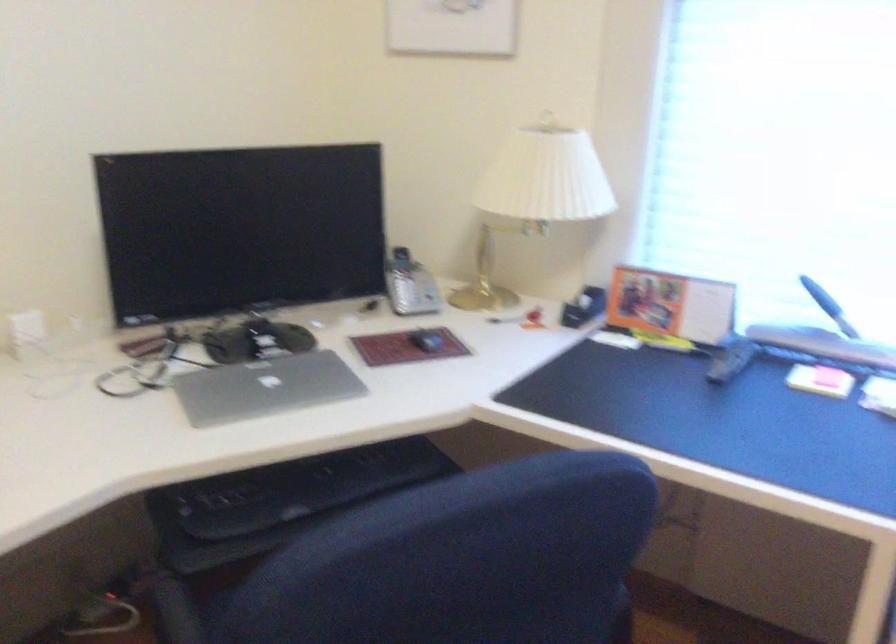
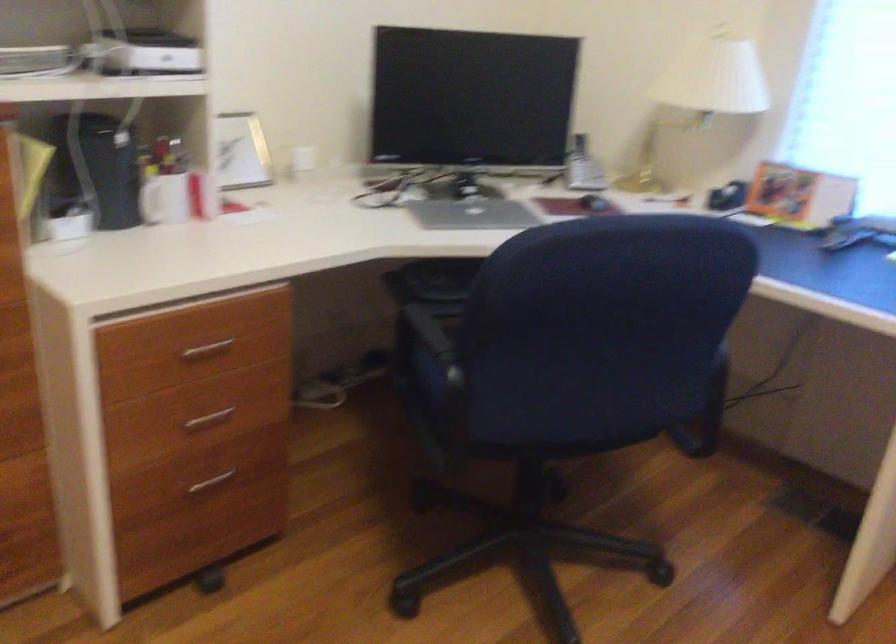
Question: The camera is either moving clockwise (left) or counter-clockwise (right) around the object. The first image is from the beginning of the video and the second image is from the end. Is the camera moving left or right when shooting the video?

Choices:
 (A) Left
 (B) Right

Answer: (B)